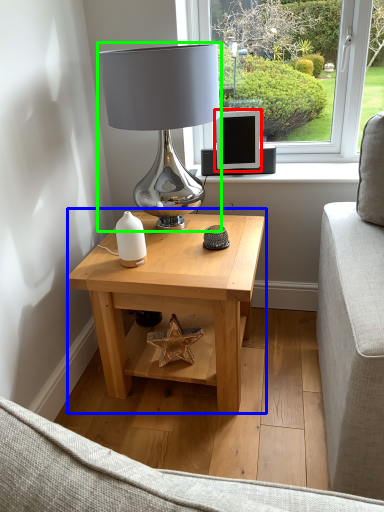
Question: Based on their relative distances, which object is farther from computer monitor (highlighted by a red box)? Choose from table (highlighted by a blue box) and table lamp (highlighted by a green box).

Choices:
 (A) table
 (B) table lamp

Answer: (A)